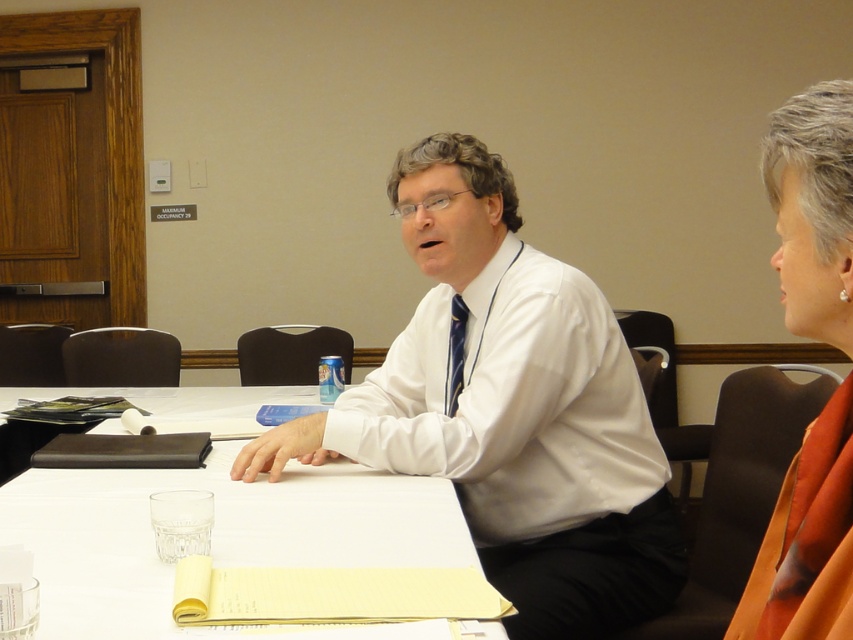
Between white glossy shirt at center and orange fabric scarf at upper right, which one has less height?

orange fabric scarf at upper right

Between white glossy shirt at center and orange fabric scarf at upper right, which one is positioned lower?

white glossy shirt at center

Between point (567, 557) and point (816, 496), which one is positioned in front?

Point (816, 496) is more forward.

What are the coordinates of `white glossy shirt at center` in the screenshot? It's located at (509, 410).

In the scene shown: Who is more distant from viewer, (593, 627) or (372, 454)?

Positioned behind is point (372, 454).

Which is below, white glossy shirt at center or white smooth dress shirt at center?

Positioned lower is white glossy shirt at center.

Locate an element on the screen. The image size is (853, 640). white glossy shirt at center is located at coordinates (509, 410).

Based on the photo, is white smooth dress shirt at center positioned behind orange fabric scarf at upper right?

Yes, it is.

Between point (387, 422) and point (831, 624), which one is positioned behind?

The point (387, 422) is behind.

Locate an element on the screen. This screenshot has height=640, width=853. white smooth dress shirt at center is located at coordinates (511, 403).